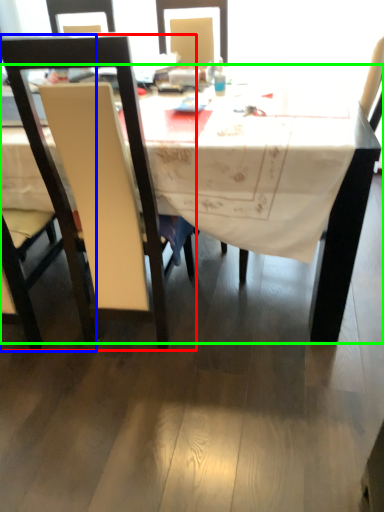
Question: Which is farther away from chair (highlighted by a red box)? chair (highlighted by a blue box) or desk (highlighted by a green box)?

Choices:
 (A) chair
 (B) desk

Answer: (B)